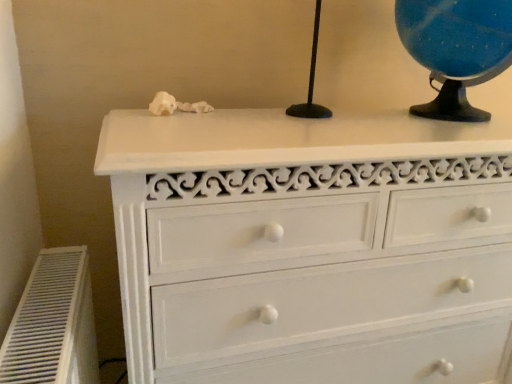
Question: Can you confirm if matte black globe at upper right is wider than white painted wood chest of drawers at upper center?

Choices:
 (A) no
 (B) yes

Answer: (A)

Question: Does matte black globe at upper right have a smaller size compared to white painted wood chest of drawers at upper center?

Choices:
 (A) yes
 (B) no

Answer: (A)

Question: Is matte black globe at upper right further to camera compared to white painted wood chest of drawers at upper center?

Choices:
 (A) yes
 (B) no

Answer: (A)

Question: From a real-world perspective, is matte black globe at upper right on top of white painted wood chest of drawers at upper center?

Choices:
 (A) yes
 (B) no

Answer: (A)

Question: From the image's perspective, is matte black globe at upper right above white painted wood chest of drawers at upper center?

Choices:
 (A) no
 (B) yes

Answer: (B)

Question: Is white painted wood chest of drawers at upper center located within matte black globe at upper right?

Choices:
 (A) no
 (B) yes

Answer: (A)

Question: Considering the relative sizes of matte black globe at upper right and white plastic air conditioner at lower left in the image provided, is matte black globe at upper right wider than white plastic air conditioner at lower left?

Choices:
 (A) no
 (B) yes

Answer: (B)

Question: Is matte black globe at upper right positioned behind white plastic air conditioner at lower left?

Choices:
 (A) no
 (B) yes

Answer: (B)

Question: Would you say white plastic air conditioner at lower left is part of matte black globe at upper right's contents?

Choices:
 (A) yes
 (B) no

Answer: (B)

Question: Can you confirm if matte black globe at upper right is positioned to the left of white plastic air conditioner at lower left?

Choices:
 (A) no
 (B) yes

Answer: (A)

Question: From the image's perspective, is matte black globe at upper right above white plastic air conditioner at lower left?

Choices:
 (A) no
 (B) yes

Answer: (B)

Question: Is matte black globe at upper right turned away from white plastic air conditioner at lower left?

Choices:
 (A) yes
 (B) no

Answer: (B)

Question: From the image's perspective, is white plastic air conditioner at lower left on top of matte black globe at upper right?

Choices:
 (A) yes
 (B) no

Answer: (B)